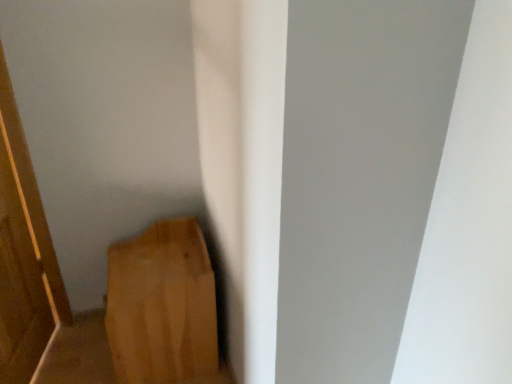
Identify the location of wooden plank at lower left. (164, 308).

Describe the element at coordinates (164, 308) in the screenshot. I see `wooden plank at lower left` at that location.

Find the location of a particular element. The image size is (512, 384). wooden door at left is located at coordinates (24, 253).

This screenshot has width=512, height=384. What do you see at coordinates (24, 253) in the screenshot?
I see `wooden door at left` at bounding box center [24, 253].

Identify the location of wooden plank at lower left. (164, 308).

Between wooden door at left and wooden plank at lower left, which one appears on the left side from the viewer's perspective?

wooden door at left.

Does wooden door at left come in front of wooden plank at lower left?

Yes, it is in front of wooden plank at lower left.

Which point is more forward, (48, 286) or (168, 294)?

The point (168, 294) is in front.

From the image's perspective, is wooden door at left above or below wooden plank at lower left?

wooden door at left is above wooden plank at lower left.

Consider the image. From a real-world perspective, between wooden door at left and wooden plank at lower left, who is vertically lower?

wooden plank at lower left.

Considering the relative sizes of wooden door at left and wooden plank at lower left in the image provided, is wooden door at left thinner than wooden plank at lower left?

Yes, wooden door at left is thinner than wooden plank at lower left.

From their relative heights in the image, would you say wooden door at left is taller or shorter than wooden plank at lower left?

In the image, wooden door at left appears to be taller than wooden plank at lower left.

Does wooden door at left have a smaller size compared to wooden plank at lower left?

Yes, wooden door at left is smaller than wooden plank at lower left.

Can wooden plank at lower left be found inside wooden door at left?

Actually, wooden plank at lower left is outside wooden door at left.

Would you say wooden door at left is a long distance from wooden plank at lower left?

No, there isn't a large distance between wooden door at left and wooden plank at lower left.

Is wooden door at left facing towards wooden plank at lower left?

No, wooden door at left is not facing towards wooden plank at lower left.

Where is `furniture below the wooden door at left (from the image's perspective)`? furniture below the wooden door at left (from the image's perspective) is located at coordinates (164, 308).

Can you confirm if wooden plank at lower left is positioned to the left of wooden door at left?

Incorrect, wooden plank at lower left is not on the left side of wooden door at left.

Which object is more forward, wooden plank at lower left or wooden door at left?

Positioned in front is wooden door at left.

Considering the positions of points (157, 304) and (10, 181), is point (157, 304) farther from camera compared to point (10, 181)?

No, (157, 304) is closer to viewer.

From the image's perspective, is wooden plank at lower left above wooden door at left?

Actually, wooden plank at lower left appears below wooden door at left in the image.

From a real-world perspective, is wooden plank at lower left located higher than wooden door at left?

No, from a real-world perspective, wooden plank at lower left is not over wooden door at left

Can you confirm if wooden plank at lower left is wider than wooden door at left?

Correct, the width of wooden plank at lower left exceeds that of wooden door at left.

Can you confirm if wooden plank at lower left is shorter than wooden door at left?

Indeed, wooden plank at lower left has a lesser height compared to wooden door at left.

Who is bigger, wooden plank at lower left or wooden door at left?

wooden plank at lower left.

Is wooden plank at lower left spatially inside wooden door at left, or outside of it?

wooden plank at lower left exists outside the volume of wooden door at left.

Is wooden plank at lower left not near wooden door at left?

No, wooden plank at lower left is in close proximity to wooden door at left.

Could you tell me if wooden plank at lower left is turned towards wooden door at left?

Yes, wooden plank at lower left is facing wooden door at left.

How many degrees apart are the facing directions of wooden plank at lower left and wooden door at left?

The facing directions of wooden plank at lower left and wooden door at left are 13.9 degrees apart.

Locate an element on the screen. door to the left of wooden plank at lower left is located at coordinates [x=24, y=253].

Where is `furniture behind the wooden door at left`? Image resolution: width=512 pixels, height=384 pixels. furniture behind the wooden door at left is located at coordinates (164, 308).

This screenshot has height=384, width=512. I want to click on furniture below the wooden door at left (from a real-world perspective), so click(x=164, y=308).